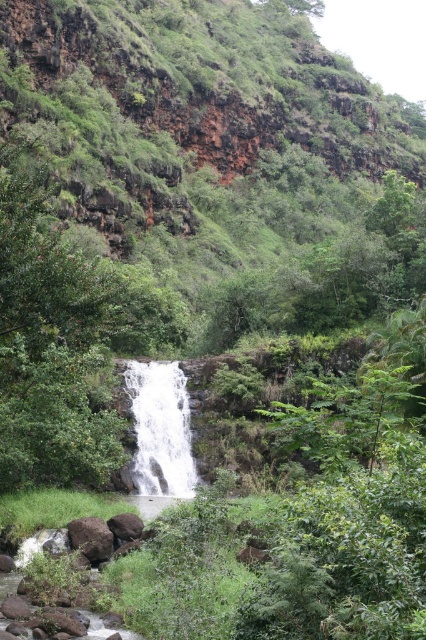
Question: Is green mossy hillside at upper center positioned in front of white frothy water at center?

Choices:
 (A) no
 (B) yes

Answer: (A)

Question: Where is white frothy water at center located in relation to brown rough rock at lower center in the image?

Choices:
 (A) below
 (B) above

Answer: (B)

Question: Which object is closer to the camera taking this photo?

Choices:
 (A) brown rough rock at lower center
 (B) white frothy water at center
 (C) smooth brown rock at lower left

Answer: (C)

Question: Which point is farther to the camera?

Choices:
 (A) (89, 518)
 (B) (74, 131)

Answer: (B)

Question: Which object is the closest to the smooth brown rock at lower left?

Choices:
 (A) brown rough rock at lower center
 (B) white frothy water at center
 (C) green mossy hillside at upper center

Answer: (A)

Question: Is green mossy hillside at upper center closer to the viewer compared to smooth brown rock at lower left?

Choices:
 (A) yes
 (B) no

Answer: (B)